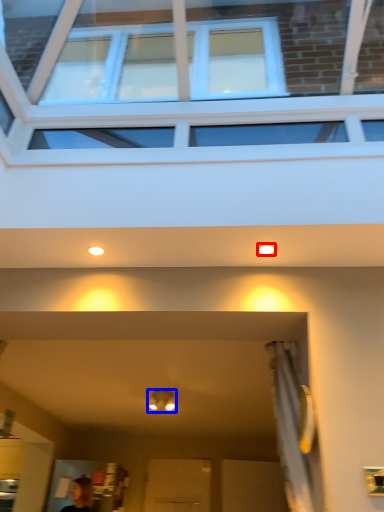
Question: Which of the following is the farthest to the observer, lighting (highlighted by a red box) or light fixture (highlighted by a blue box)?

Choices:
 (A) lighting
 (B) light fixture

Answer: (B)